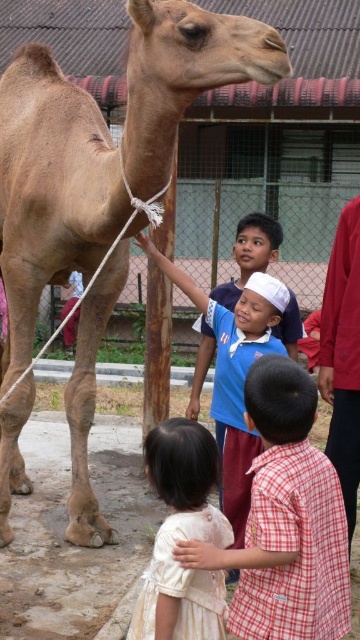
Between white cotton shirt at center and white cotton dress at lower center, which one has less height?

Standing shorter between the two is white cotton dress at lower center.

Does white cotton shirt at center come in front of white cotton dress at lower center?

Yes, white cotton shirt at center is closer to the viewer.

Is point (213, 552) positioned behind point (196, 499)?

No, (213, 552) is in front of (196, 499).

Where is `white cotton shirt at center`? Image resolution: width=360 pixels, height=640 pixels. white cotton shirt at center is located at coordinates (285, 520).

What do you see at coordinates (51, 189) in the screenshot?
I see `brown textured camel at left` at bounding box center [51, 189].

Is brown textured camel at left further to camera compared to white cotton shirt at center?

Yes.

Which is behind, point (19, 296) or point (249, 412)?

Point (19, 296)

Identify the location of brown textured camel at left. The height and width of the screenshot is (640, 360). (51, 189).

Is brown textured camel at left in front of white cotton dress at lower center?

No, brown textured camel at left is further to the viewer.

Is brown textured camel at left smaller than white cotton dress at lower center?

No.

The image size is (360, 640). I want to click on brown textured camel at left, so click(51, 189).